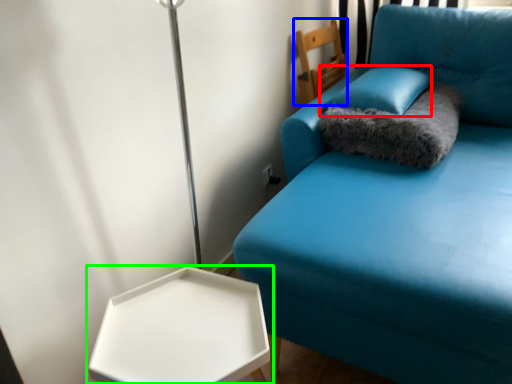
Question: Which is nearer to the pillow (highlighted by a red box)? furniture (highlighted by a blue box) or table (highlighted by a green box).

Choices:
 (A) furniture
 (B) table

Answer: (A)